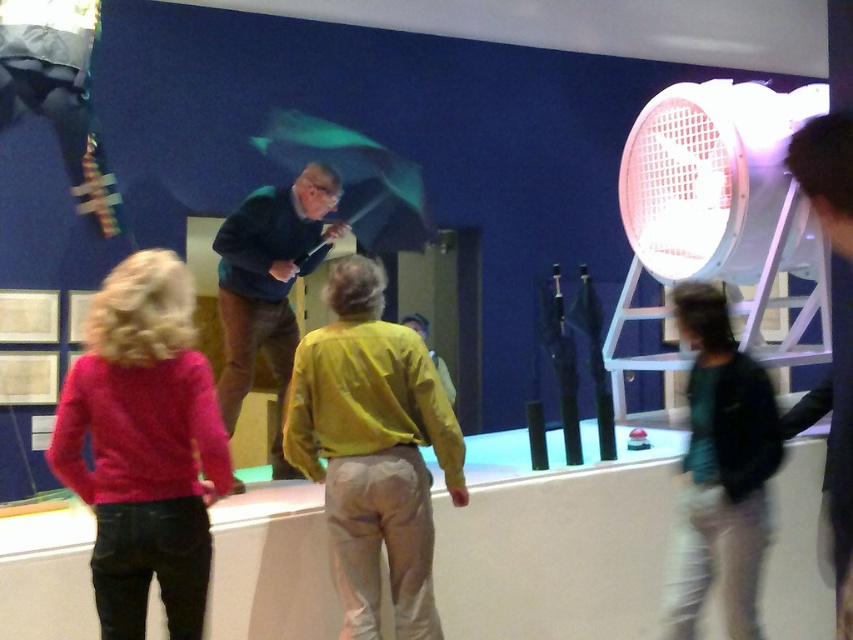
Which is in front, point (373, 392) or point (718, 461)?

Point (373, 392) is in front.

Can you confirm if yellow fabric shirt at center is taller than green matte jacket at lower right?

In fact, yellow fabric shirt at center may be shorter than green matte jacket at lower right.

Looking at this image, who is more forward, (415, 604) or (686, 540)?

Positioned in front is point (415, 604).

The height and width of the screenshot is (640, 853). I want to click on yellow fabric shirt at center, so click(373, 451).

Looking at this image, does pink sweater at lower left lie behind green matte jacket at lower right?

No.

Is point (144, 497) farther from viewer compared to point (759, 460)?

No, it is in front of (759, 460).

The height and width of the screenshot is (640, 853). Find the location of `pink sweater at lower left`. pink sweater at lower left is located at coordinates (144, 445).

Can you confirm if pink sweater at lower left is wider than yellow fabric shirt at center?

In fact, pink sweater at lower left might be narrower than yellow fabric shirt at center.

Which is behind, point (109, 337) or point (463, 488)?

The point (463, 488) is more distant.

I want to click on pink sweater at lower left, so click(x=144, y=445).